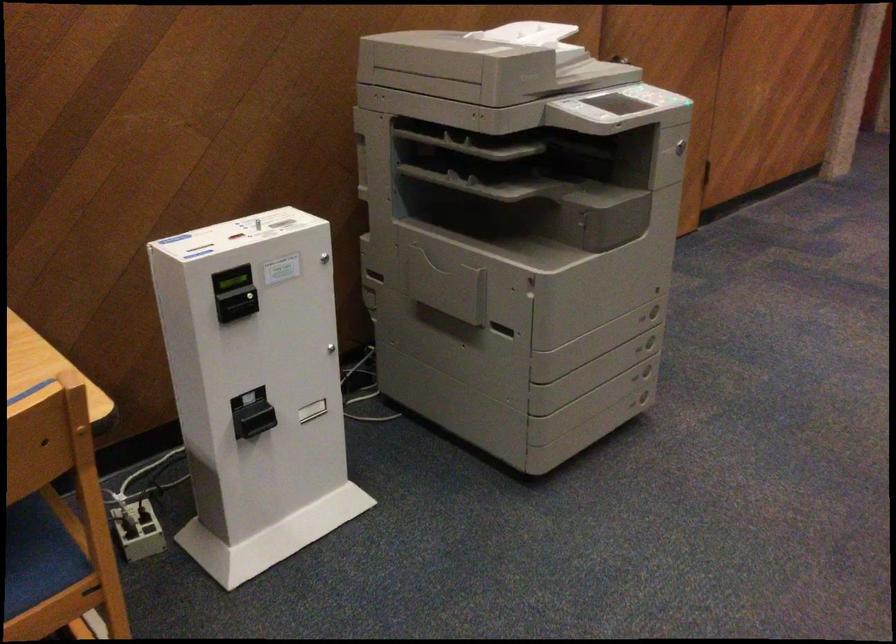
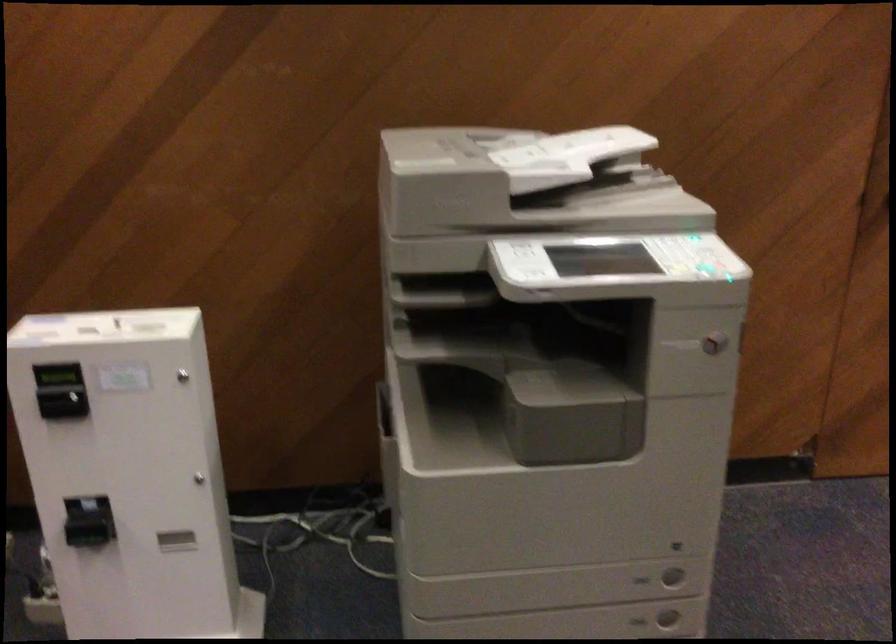
In the second image, find the point that corresponds to (645,319) in the first image.

(642, 580)